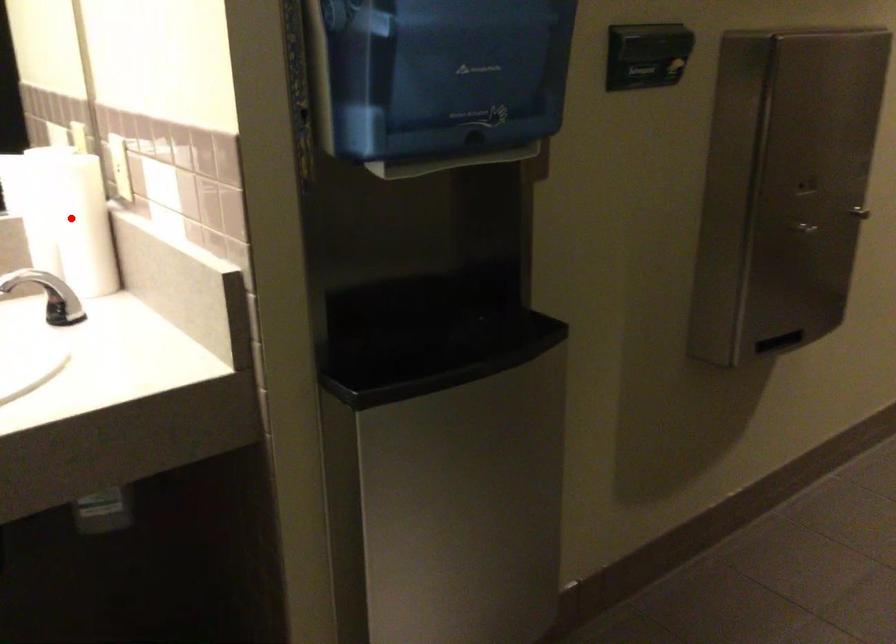
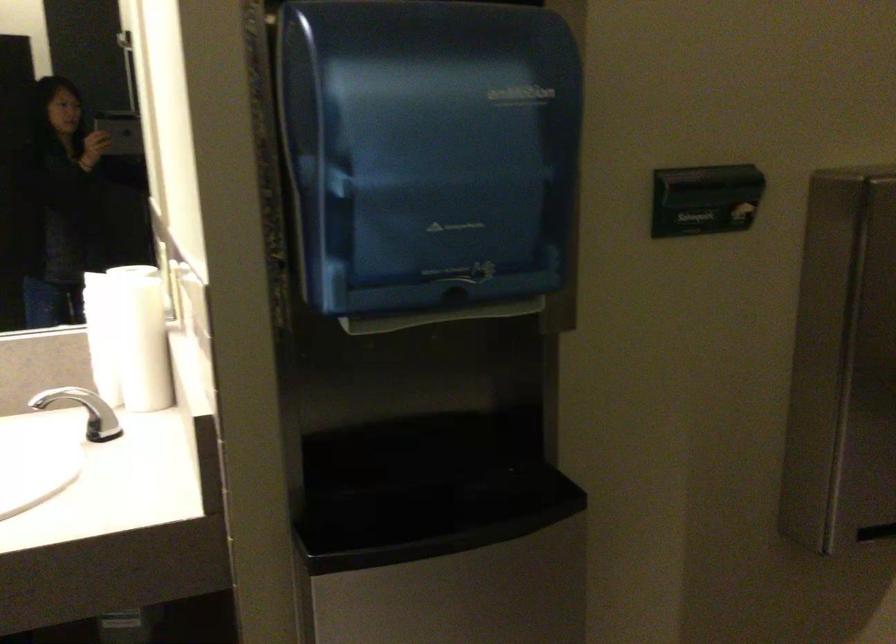
The point at the highlighted location is marked in the first image. Where is the corresponding point in the second image?

(128, 337)